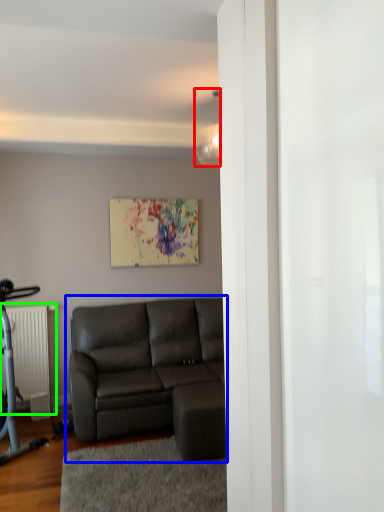
Question: Which object is positioned closest to light fixture (highlighted by a red box)? Select from studio couch (highlighted by a blue box) and radiator (highlighted by a green box).

Choices:
 (A) studio couch
 (B) radiator

Answer: (A)